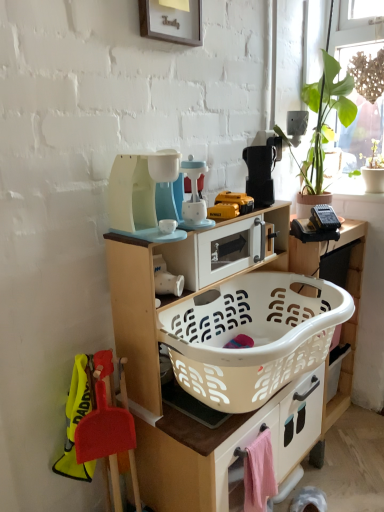
What do you see at coordinates (230, 205) in the screenshot? This screenshot has height=512, width=384. I see `yellow plastic drill at center` at bounding box center [230, 205].

Locate an element on the screen. The image size is (384, 512). woven wood screen at upper right is located at coordinates (356, 25).

From the picture: What is the approximate width of black plastic toaster at upper center, placed as the 4th appliance when sorted from left to right?

black plastic toaster at upper center, placed as the 4th appliance when sorted from left to right, is 6.62 inches in width.

Measure the distance between black plastic toaster at upper center, placed as the 4th appliance when sorted from left to right, and camera.

They are 1.40 meters apart.

What is the approximate height of pink fabric drawer at lower right?

pink fabric drawer at lower right is 12.60 inches in height.

Find the location of `green leafy plant at upper right`. green leafy plant at upper right is located at coordinates (324, 124).

From the picture: Does green leafy plant at upper right have a lesser width compared to white plastic microwave at center, the second appliance in the right-to-left sequence?

In fact, green leafy plant at upper right might be wider than white plastic microwave at center, the second appliance in the right-to-left sequence.

From a real-world perspective, is green leafy plant at upper right on top of white plastic microwave at center, arranged as the 3th appliance when viewed from the left?

Yes, from a real-world perspective, green leafy plant at upper right is over white plastic microwave at center, arranged as the 3th appliance when viewed from the left

Could you tell me if green leafy plant at upper right is turned towards white plastic microwave at center, arranged as the 3th appliance when viewed from the left?

No, green leafy plant at upper right does not turn towards white plastic microwave at center, arranged as the 3th appliance when viewed from the left.

Would you say woven wood screen at upper right is inside or outside white matte cup at center, positioned as the 3th appliance in right-to-left order?

woven wood screen at upper right is located beyond the bounds of white matte cup at center, positioned as the 3th appliance in right-to-left order.

Between woven wood screen at upper right and white matte cup at center, positioned as the 2th appliance in left-to-right order, which one has larger size?

With larger size is woven wood screen at upper right.

Which object is closer to the camera taking this photo, woven wood screen at upper right or white matte cup at center, positioned as the 3th appliance in right-to-left order?

Positioned in front is white matte cup at center, positioned as the 3th appliance in right-to-left order.

Considering the sizes of green leafy plant at upper right and white plastic laundry basket at center in the image, is green leafy plant at upper right taller or shorter than white plastic laundry basket at center?

Considering their sizes, green leafy plant at upper right has less height than white plastic laundry basket at center.

From the picture: From a real-world perspective, is green leafy plant at upper right above or below white plastic laundry basket at center?

Clearly, from a real-world perspective, green leafy plant at upper right is above white plastic laundry basket at center.

Which of these two, green leafy plant at upper right or white plastic laundry basket at center, is thinner?

Thinner between the two is green leafy plant at upper right.

The height and width of the screenshot is (512, 384). I want to click on houseplant above the white matte cup at center, positioned as the 3th appliance in right-to-left order (from a real-world perspective), so click(x=324, y=124).

Consider the image. Would you say white matte cup at center, positioned as the 2th appliance in left-to-right order, is to the left or to the right of green leafy plant at upper right in the picture?

Based on their positions, white matte cup at center, positioned as the 2th appliance in left-to-right order, is located to the left of green leafy plant at upper right.

Who is shorter, white matte cup at center, positioned as the 3th appliance in right-to-left order, or green leafy plant at upper right?

white matte cup at center, positioned as the 3th appliance in right-to-left order.

Who is shorter, pink fabric drawer at lower right or woven wood screen at upper right?

Standing shorter between the two is pink fabric drawer at lower right.

Is pink fabric drawer at lower right oriented towards woven wood screen at upper right?

No.

From the picture: From the image's perspective, is pink fabric drawer at lower right on top of woven wood screen at upper right?

No, from the image's perspective, pink fabric drawer at lower right is not above woven wood screen at upper right.

Considering their positions, is pink fabric drawer at lower right located in front of or behind woven wood screen at upper right?

Visually, pink fabric drawer at lower right is located in front of woven wood screen at upper right.

What's the angular difference between wooden frame at upper center and white plastic microwave at center, the second appliance in the right-to-left sequence,'s facing directions?

The angle between the facing direction of wooden frame at upper center and the facing direction of white plastic microwave at center, the second appliance in the right-to-left sequence, is 0.796 degrees.

Looking at this image, is white plastic microwave at center, the second appliance in the right-to-left sequence, a part of wooden frame at upper center?

No, white plastic microwave at center, the second appliance in the right-to-left sequence, is located outside of wooden frame at upper center.

Considering the sizes of wooden frame at upper center and white plastic microwave at center, arranged as the 3th appliance when viewed from the left, in the image, is wooden frame at upper center wider or thinner than white plastic microwave at center, arranged as the 3th appliance when viewed from the left,?

wooden frame at upper center is thinner than white plastic microwave at center, arranged as the 3th appliance when viewed from the left.

From a real-world perspective, does wooden frame at upper center stand above white plastic microwave at center, arranged as the 3th appliance when viewed from the left?

Yes, from a real-world perspective, wooden frame at upper center is above white plastic microwave at center, arranged as the 3th appliance when viewed from the left.

Is matte plastic toy coffee maker at center, which is the 1th appliance from left to right, not inside white matte cup at center, positioned as the 2th appliance in left-to-right order?

Yes, matte plastic toy coffee maker at center, which is the 1th appliance from left to right, is not within white matte cup at center, positioned as the 2th appliance in left-to-right order.

Consider the image. From a real-world perspective, is matte plastic toy coffee maker at center, which is the 1th appliance from left to right, positioned over white matte cup at center, positioned as the 2th appliance in left-to-right order, based on gravity?

Correct, in the physical world, matte plastic toy coffee maker at center, which is the 1th appliance from left to right, is higher than white matte cup at center, positioned as the 2th appliance in left-to-right order.

Based on the photo, would you say matte plastic toy coffee maker at center, which is the 1th appliance from left to right, is a long distance from white matte cup at center, positioned as the 3th appliance in right-to-left order?

No, matte plastic toy coffee maker at center, which is the 1th appliance from left to right, is not far from white matte cup at center, positioned as the 3th appliance in right-to-left order.

Is matte plastic toy coffee maker at center, which is counted as the 4th appliance, starting from the right, wider or thinner than white matte cup at center, positioned as the 2th appliance in left-to-right order?

Considering their sizes, matte plastic toy coffee maker at center, which is counted as the 4th appliance, starting from the right, looks broader than white matte cup at center, positioned as the 2th appliance in left-to-right order.

Identify the location of the 1st appliance in front of the green leafy plant at upper right. (219, 251).

Locate an element on the screen. The height and width of the screenshot is (512, 384). the 3rd appliance counting from the left of the woven wood screen at upper right is located at coordinates (166, 278).

Based on their spatial positions, is wooden frame at upper center or yellow plastic drill at center closer to white matte cup at center, positioned as the 2th appliance in left-to-right order?

yellow plastic drill at center is closer to white matte cup at center, positioned as the 2th appliance in left-to-right order.

From the image, which object appears to be farther from white plastic microwave at center, the second appliance in the right-to-left sequence, black plastic toaster at upper center, placed as the 4th appliance when sorted from left to right, or yellow plastic drill at center?

black plastic toaster at upper center, placed as the 4th appliance when sorted from left to right.

Based on their spatial positions, is white plastic laundry basket at center or yellow plastic drill at center further from woven wood screen at upper right?

white plastic laundry basket at center is positioned further to the anchor woven wood screen at upper right.

Consider the image. Which object lies nearer to the anchor point matte plastic toy coffee maker at center, which is counted as the 4th appliance, starting from the right, white matte cup at center, positioned as the 3th appliance in right-to-left order, or white plastic laundry basket at center?

white matte cup at center, positioned as the 3th appliance in right-to-left order.

When comparing their distances from matte plastic toy coffee maker at center, which is counted as the 4th appliance, starting from the right, does white matte cup at center, positioned as the 3th appliance in right-to-left order, or white plastic microwave at center, the second appliance in the right-to-left sequence, seem further?

Among the two, white matte cup at center, positioned as the 3th appliance in right-to-left order, is located further to matte plastic toy coffee maker at center, which is counted as the 4th appliance, starting from the right.

Considering their positions, is black plastic toaster at upper center, placed as the 4th appliance when sorted from left to right, positioned further to white plastic laundry basket at center than yellow plastic drill at center?

black plastic toaster at upper center, placed as the 4th appliance when sorted from left to right, is further to white plastic laundry basket at center.

Looking at the image, which one is located further to wooden frame at upper center, green leafy plant at upper right or black plastic toaster at upper center, the first appliance from the right?

green leafy plant at upper right is further to wooden frame at upper center.

When comparing their distances from yellow plastic drill at center, does white plastic microwave at center, arranged as the 3th appliance when viewed from the left, or white plastic laundry basket at center seem closer?

white plastic microwave at center, arranged as the 3th appliance when viewed from the left.

The image size is (384, 512). I want to click on toy between woven wood screen at upper right and white plastic microwave at center, arranged as the 3th appliance when viewed from the left, vertically, so click(x=230, y=205).

Image resolution: width=384 pixels, height=512 pixels. Identify the location of toy that lies between black plastic toaster at upper center, the first appliance from the right, and white plastic laundry basket at center from top to bottom. (230, 205).

At what (x,y) coordinates should I click in order to perform the action: click on toy between matte plastic toy coffee maker at center, which is counted as the 4th appliance, starting from the right, and black plastic toaster at upper center, the first appliance from the right, along the z-axis. Please return your answer as a coordinate pair (x, y). The width and height of the screenshot is (384, 512). Looking at the image, I should click on (230, 205).

You are a GUI agent. You are given a task and a screenshot of the screen. Output one action in this format:
    pyautogui.click(x=<x>, y=<y>)
    Task: Click on the houseplant between wooden frame at upper center and white plastic laundry basket at center from top to bottom
    This screenshot has width=384, height=512.
    Given the screenshot: What is the action you would take?
    pos(324,124)